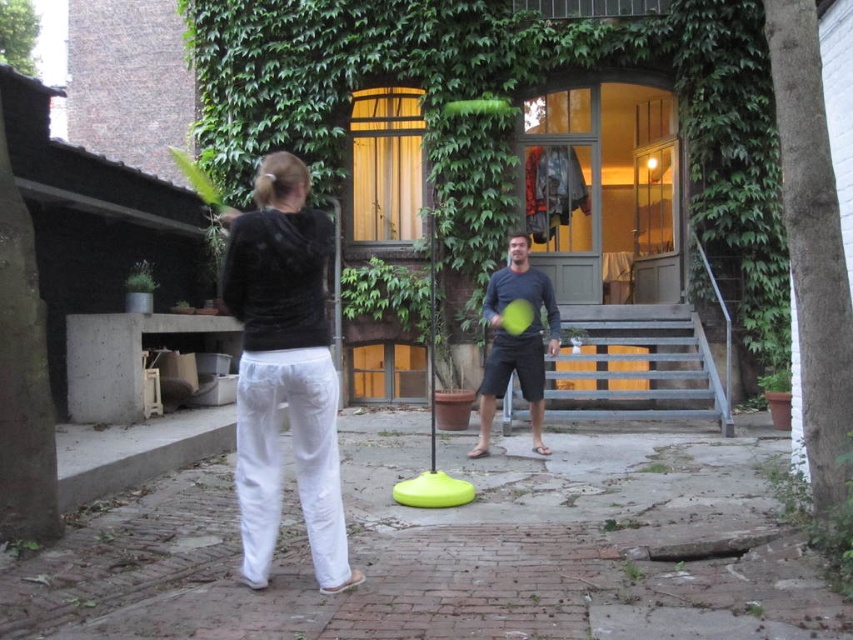
You are a delivery drone that needs to deliver a package to the person wearing the velvet black hoodie at center. There is an obstacle in the form of a dark blue cotton shirt at center. What is the minimum distance you should fly to avoid hitting the obstacle?

The minimum distance you should fly to avoid hitting the obstacle is 3.81 meters, as the velvet black hoodie at center and dark blue cotton shirt at center are 3.81 meters apart.

You are a fashion designer observing the outdoor scene. You notice two people wearing the velvet black hoodie at center and the dark blue cotton shirt at center. Which clothing item is positioned higher in the image?

The velvet black hoodie at center is taller than the dark blue cotton shirt at center, so the velvet black hoodie at center is positioned higher in the image.